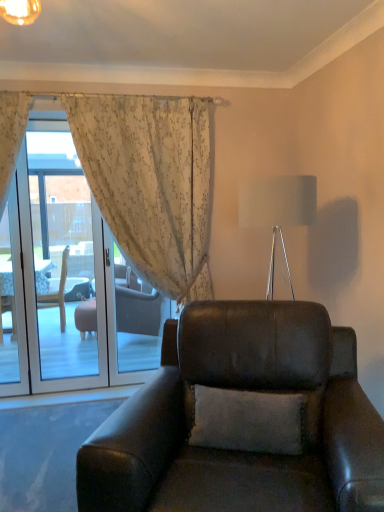
Question: From the image's perspective, is floral sheer curtain at upper left located above transparent glass screen door at left?

Choices:
 (A) no
 (B) yes

Answer: (B)

Question: Are floral sheer curtain at upper left and transparent glass screen door at left located far from each other?

Choices:
 (A) yes
 (B) no

Answer: (A)

Question: Considering the relative sizes of floral sheer curtain at upper left and transparent glass screen door at left in the image provided, is floral sheer curtain at upper left shorter than transparent glass screen door at left?

Choices:
 (A) yes
 (B) no

Answer: (B)

Question: From a real-world perspective, is floral sheer curtain at upper left located beneath transparent glass screen door at left?

Choices:
 (A) no
 (B) yes

Answer: (A)

Question: Is floral sheer curtain at upper left next to transparent glass screen door at left?

Choices:
 (A) no
 (B) yes

Answer: (A)

Question: From their relative heights in the image, would you say transparent glass screen door at left is taller or shorter than floral sheer curtain at upper left?

Choices:
 (A) tall
 (B) short

Answer: (B)

Question: In the image, is transparent glass screen door at left positioned in front of or behind floral sheer curtain at upper left?

Choices:
 (A) front
 (B) behind

Answer: (B)

Question: Looking at their shapes, would you say transparent glass screen door at left is wider or thinner than floral sheer curtain at upper left?

Choices:
 (A) wide
 (B) thin

Answer: (B)

Question: Which is correct: transparent glass screen door at left is inside floral sheer curtain at upper left, or outside of it?

Choices:
 (A) outside
 (B) inside

Answer: (A)

Question: Which is correct: floral sheer curtain at upper left is inside white fabric lampshade at upper center, or outside of it?

Choices:
 (A) inside
 (B) outside

Answer: (B)

Question: From the image's perspective, is floral sheer curtain at upper left above or below white fabric lampshade at upper center?

Choices:
 (A) above
 (B) below

Answer: (B)

Question: Is floral sheer curtain at upper left in front of or behind white fabric lampshade at upper center in the image?

Choices:
 (A) front
 (B) behind

Answer: (B)

Question: Is floral sheer curtain at upper left wider or thinner than white fabric lampshade at upper center?

Choices:
 (A) wide
 (B) thin

Answer: (B)

Question: From the image's perspective, is transparent glass screen door at left located above or below matte black leather armchair at center?

Choices:
 (A) above
 (B) below

Answer: (A)

Question: Choose the correct answer: Is transparent glass screen door at left inside matte black leather armchair at center or outside it?

Choices:
 (A) inside
 (B) outside

Answer: (B)